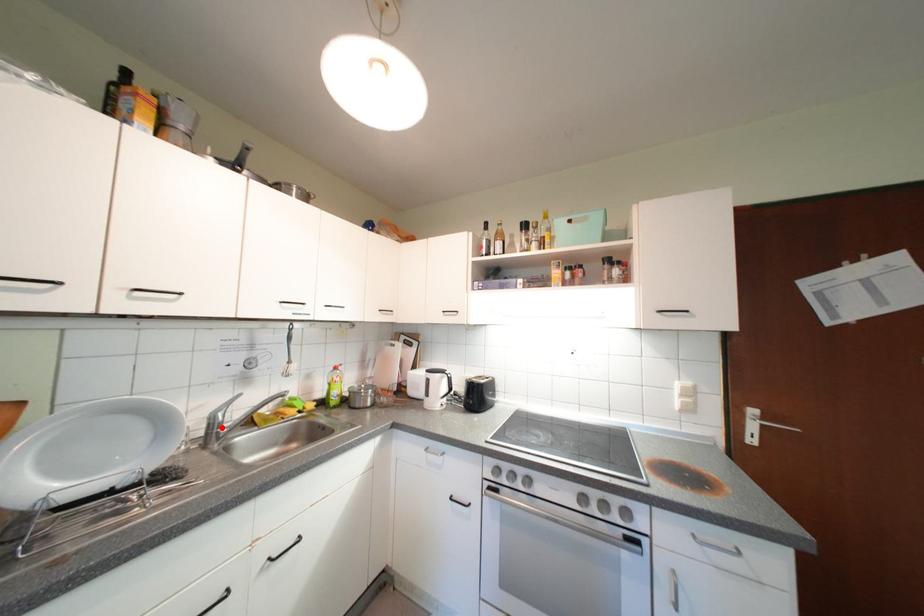
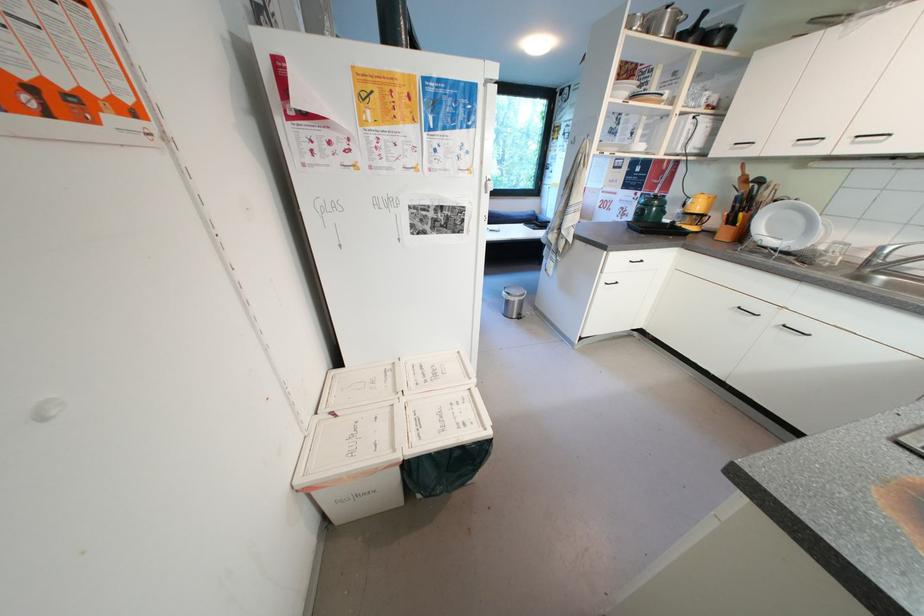
The point at the highlighted location is marked in the first image. Where is the corresponding point in the second image?

(883, 257)